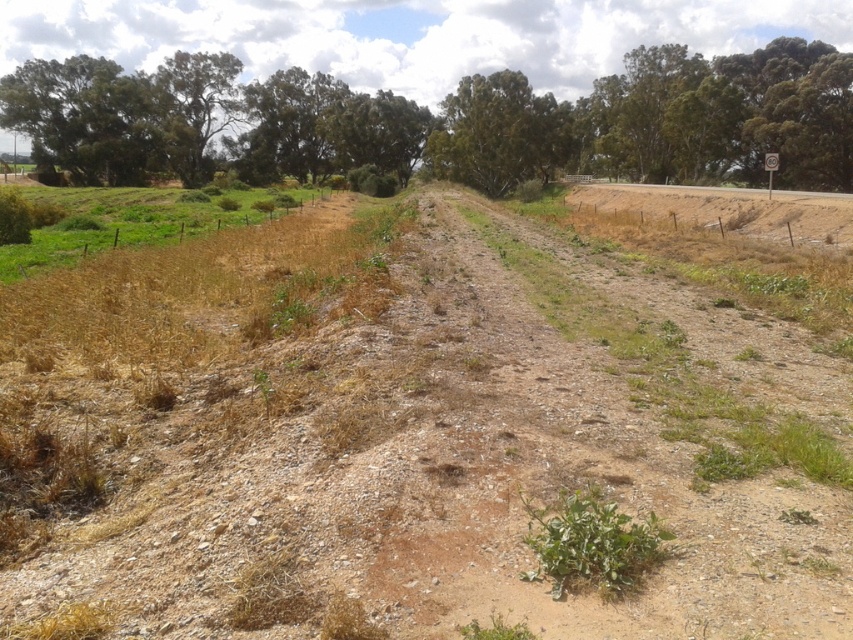
Question: Which point is closer to the camera taking this photo?

Choices:
 (A) (717, 115)
 (B) (526, 108)
 (C) (86, 198)

Answer: (C)

Question: Which point is farther from the camera taking this photo?

Choices:
 (A) tap(612, 524)
 (B) tap(508, 99)
 (C) tap(813, 68)
 (D) tap(67, 358)

Answer: (B)

Question: Considering the relative positions of green leafy tree at center and green leafy plant at center in the image provided, where is green leafy tree at center located with respect to green leafy plant at center?

Choices:
 (A) below
 (B) above

Answer: (B)

Question: Does dried grass at center have a larger size compared to dry grass at left?

Choices:
 (A) yes
 (B) no

Answer: (B)

Question: Is green leafy tree at upper center to the right of green leafy tree at center from the viewer's perspective?

Choices:
 (A) yes
 (B) no

Answer: (B)

Question: Considering the real-world distances, which object is farthest from the dry grass at left?

Choices:
 (A) green leafy tree at upper center
 (B) green leafy tree at center
 (C) dried grass at center
 (D) green leafy plant at center

Answer: (A)